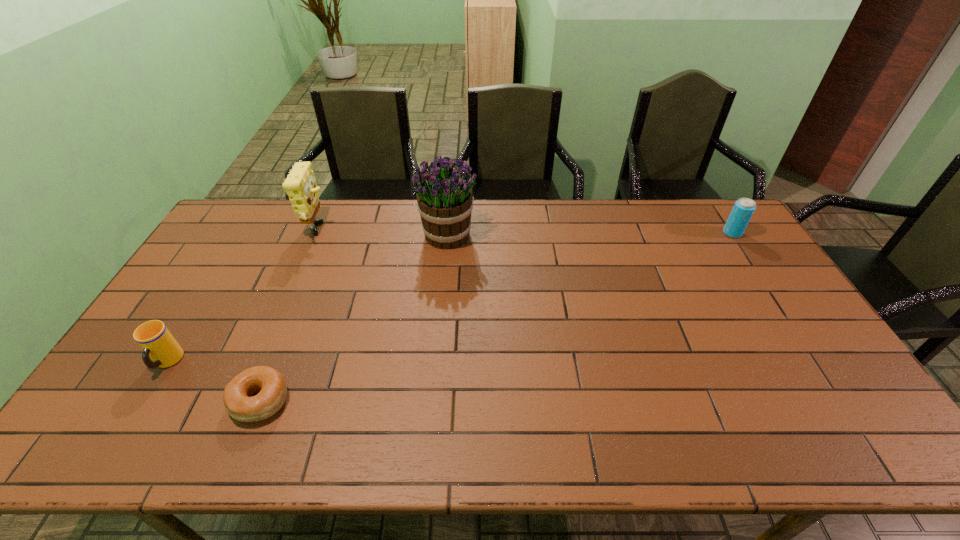
You are a GUI agent. You are given a task and a screenshot of the screen. Output one action in this format:
    pyautogui.click(x=<x>, y=<y>)
    Task: Click on the vacant region at the left edge of the desktop
    The image size is (960, 540).
    Given the screenshot: What is the action you would take?
    pyautogui.click(x=203, y=319)

Find the location of a particular element. free space at the right edge of the desktop is located at coordinates (803, 345).

Image resolution: width=960 pixels, height=540 pixels. Find the location of `blank space at the far left corner of the desktop`. blank space at the far left corner of the desktop is located at coordinates (252, 226).

In the image, there is a desktop. Where is `free region at the far right corner`? The width and height of the screenshot is (960, 540). free region at the far right corner is located at coordinates (725, 234).

Locate an element on the screen. The image size is (960, 540). unoccupied area between the second tallest object and the shortest object is located at coordinates (289, 316).

Where is `vacant area between the fourth object from left to right and the rightmost object`? vacant area between the fourth object from left to right and the rightmost object is located at coordinates (590, 234).

At what (x,y) coordinates should I click in order to perform the action: click on blank region between the rightmost object and the tallest object. Please return your answer as a coordinate pair (x, y). Image resolution: width=960 pixels, height=540 pixels. Looking at the image, I should click on (590, 234).

Locate an element on the screen. The height and width of the screenshot is (540, 960). empty location between the bagel and the bouquet is located at coordinates (354, 318).

At what (x,y) coordinates should I click in order to perform the action: click on free space that is in between the soda can and the second object from right to left. Please return your answer as a coordinate pair (x, y). This screenshot has height=540, width=960. Looking at the image, I should click on (590, 234).

Find the location of `vacant area between the sponge and the second object from right to left`. vacant area between the sponge and the second object from right to left is located at coordinates (383, 233).